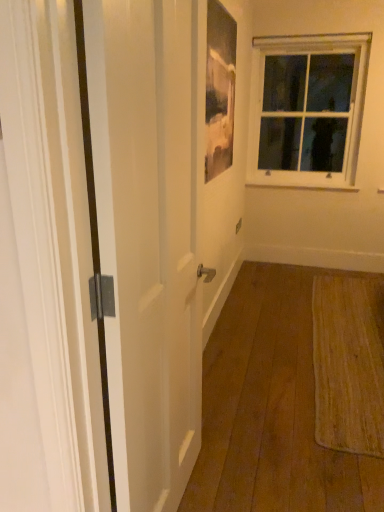
Question: Would you say white painted wood at upper right is outside white glossy door at left?

Choices:
 (A) no
 (B) yes

Answer: (B)

Question: Is white painted wood at upper right far from white glossy door at left?

Choices:
 (A) yes
 (B) no

Answer: (A)

Question: Is white glossy door at left located within white painted wood at upper right?

Choices:
 (A) yes
 (B) no

Answer: (B)

Question: From a real-world perspective, does white painted wood at upper right stand above white glossy door at left?

Choices:
 (A) yes
 (B) no

Answer: (B)

Question: Considering the relative sizes of white painted wood at upper right and white glossy door at left in the image provided, is white painted wood at upper right taller than white glossy door at left?

Choices:
 (A) no
 (B) yes

Answer: (A)

Question: Can you confirm if white painted wood at upper right is smaller than white glossy door at left?

Choices:
 (A) yes
 (B) no

Answer: (A)

Question: From a real-world perspective, is matte glass picture frame at upper center beneath clear glass window at upper right?

Choices:
 (A) no
 (B) yes

Answer: (A)

Question: Does matte glass picture frame at upper center have a larger size compared to clear glass window at upper right?

Choices:
 (A) no
 (B) yes

Answer: (A)

Question: Is matte glass picture frame at upper center behind clear glass window at upper right?

Choices:
 (A) no
 (B) yes

Answer: (A)

Question: Is matte glass picture frame at upper center in front of clear glass window at upper right?

Choices:
 (A) yes
 (B) no

Answer: (A)

Question: Is matte glass picture frame at upper center with clear glass window at upper right?

Choices:
 (A) yes
 (B) no

Answer: (B)

Question: Is matte glass picture frame at upper center at the left side of clear glass window at upper right?

Choices:
 (A) yes
 (B) no

Answer: (A)

Question: Is clear glass window at upper right far away from matte glass picture frame at upper center?

Choices:
 (A) yes
 (B) no

Answer: (A)